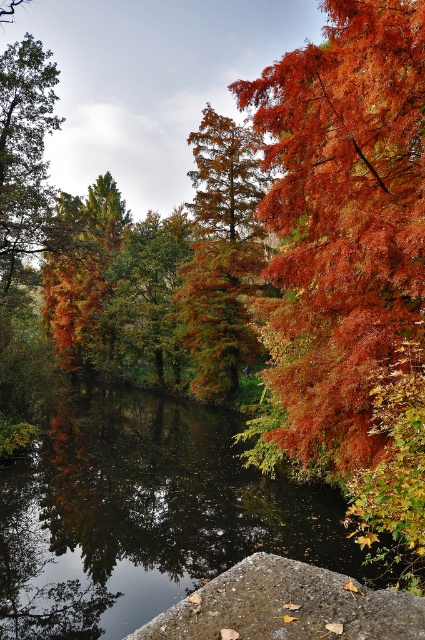
You are an artist sketching the autumn scene. You want to ensure the proportions are accurate. Which object, the shiny orange leaves at right or the orange matte tree at center, should you draw smaller in your sketch?

The shiny orange leaves at right should be drawn smaller than the orange matte tree at center because the shiny orange leaves at right is not as tall as orange matte tree at center.

You are standing at the center of the image and want to pick up the shiny orange leaves at right. In which direction should you move to reach them?

The shiny orange leaves at right are located at point (342, 221), so you should move to the right to reach them.